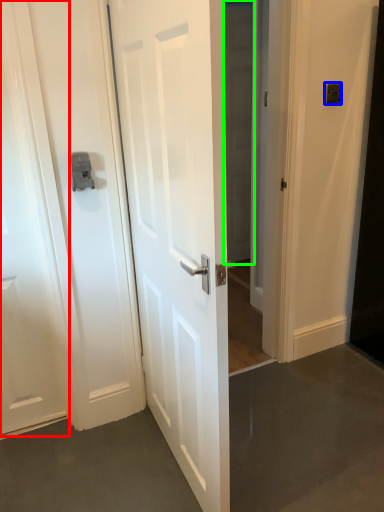
Question: Considering the real-world distances, which object is farthest from door (highlighted by a red box)? light switch (highlighted by a blue box) or glass door (highlighted by a green box)?

Choices:
 (A) light switch
 (B) glass door

Answer: (A)